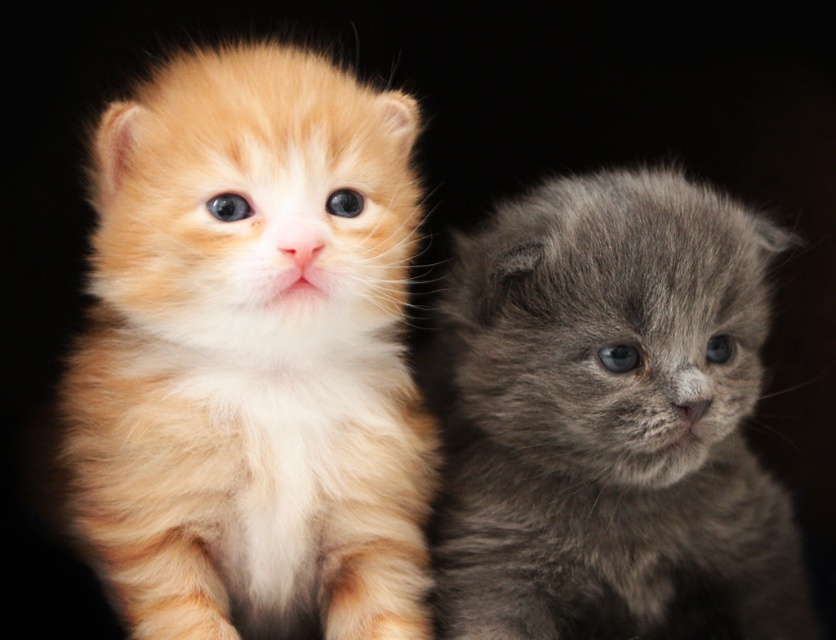
Does fluffy orange kitten at center appear on the left side of gray fluffy kitten at right?

Correct, you'll find fluffy orange kitten at center to the left of gray fluffy kitten at right.

Between point (335, 141) and point (617, 472), which one is positioned in front?

Positioned in front is point (335, 141).

The image size is (836, 640). What do you see at coordinates (251, 356) in the screenshot? I see `fluffy orange kitten at center` at bounding box center [251, 356].

What are the coordinates of `fluffy orange kitten at center` in the screenshot? It's located at (251, 356).